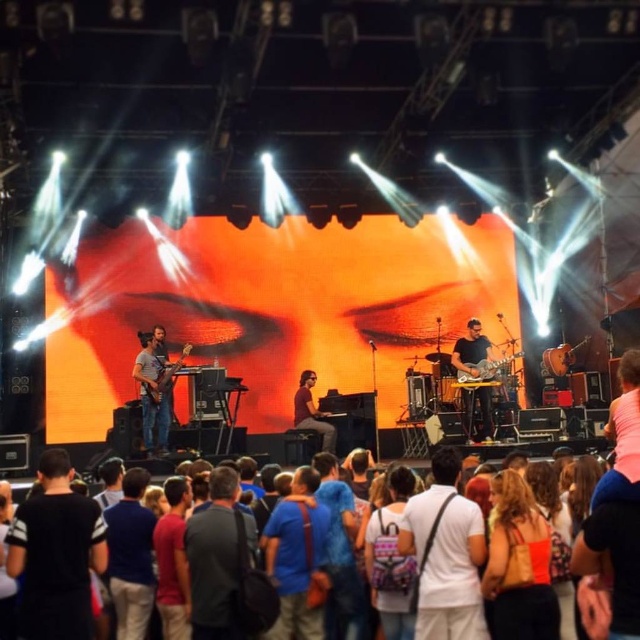
Which is in front, point (156, 429) or point (472, 349)?

Point (156, 429)

Is point (166, 436) positioned after point (468, 376)?

No, it is in front of (468, 376).

Does point (161, 333) come closer to viewer compared to point (460, 346)?

Yes, point (161, 333) is in front of point (460, 346).

At what (x,y) coordinates should I click in order to perform the action: click on shiny metallic guitar at left. Please return your answer as a coordinate pair (x, y). This screenshot has height=640, width=640. Looking at the image, I should click on (154, 390).

Is metallic guitar at center above matte black bass guitar at center?

Yes.

Between metallic guitar at center and matte black bass guitar at center, which one appears on the left side from the viewer's perspective?

matte black bass guitar at center is more to the left.

Which is in front, point (493, 371) or point (161, 394)?

Point (493, 371) is in front.

You are a GUI agent. You are given a task and a screenshot of the screen. Output one action in this format:
    pyautogui.click(x=<x>, y=<y>)
    Task: Click on the metallic guitar at center
    
    Given the screenshot: What is the action you would take?
    click(x=474, y=353)

Between point (611, 621) and point (470, 374), which one is positioned in front?

Point (611, 621) is more forward.

Describe the element at coordinates (54, 461) in the screenshot. I see `multicolored fabric crowd at lower center` at that location.

Which is behind, point (49, 449) or point (458, 369)?

Positioned behind is point (49, 449).

The width and height of the screenshot is (640, 640). I want to click on multicolored fabric crowd at lower center, so click(54, 461).